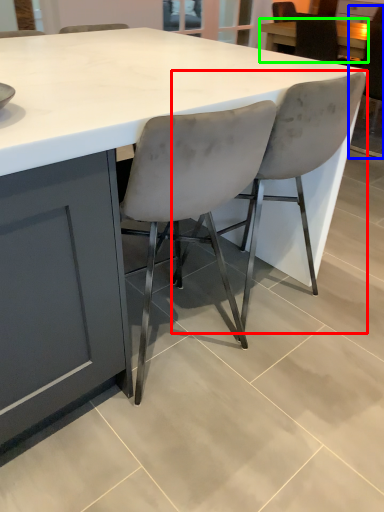
Question: Considering the real-world distances, which object is farthest from chair (highlighted by a red box)? chair (highlighted by a blue box) or table (highlighted by a green box)?

Choices:
 (A) chair
 (B) table

Answer: (B)